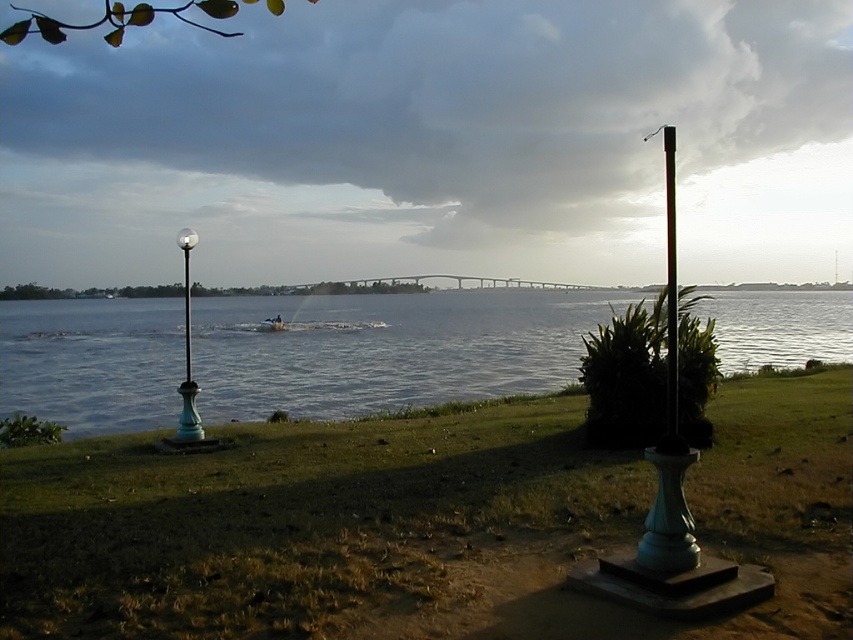
Is polished dark brown pole at right shorter than green glass lamp post at left?

In fact, polished dark brown pole at right may be taller than green glass lamp post at left.

What do you see at coordinates (669, 426) in the screenshot? This screenshot has height=640, width=853. I see `polished dark brown pole at right` at bounding box center [669, 426].

Where is `polished dark brown pole at right`? polished dark brown pole at right is located at coordinates (669, 426).

Is clear water at center below green glass lamp post at left?

Incorrect, clear water at center is not positioned below green glass lamp post at left.

From the picture: Can you confirm if clear water at center is shorter than green glass lamp post at left?

No, clear water at center is not shorter than green glass lamp post at left.

You are a GUI agent. You are given a task and a screenshot of the screen. Output one action in this format:
    pyautogui.click(x=<x>, y=<y>)
    Task: Click on the clear water at center
    
    Given the screenshot: What is the action you would take?
    pyautogui.click(x=389, y=349)

Based on the photo, which of these two, clear water at center or polished dark brown pole at right, stands shorter?

clear water at center

You are a GUI agent. You are given a task and a screenshot of the screen. Output one action in this format:
    pyautogui.click(x=<x>, y=<y>)
    Task: Click on the clear water at center
    The height and width of the screenshot is (640, 853).
    Given the screenshot: What is the action you would take?
    pyautogui.click(x=389, y=349)

The image size is (853, 640). Find the location of `clear water at center`. clear water at center is located at coordinates (389, 349).

This screenshot has height=640, width=853. I want to click on clear water at center, so click(389, 349).